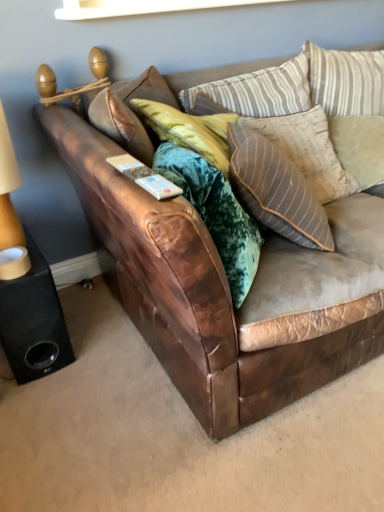
Where is `vacant point to the right of black matte speaker at lower left`? Image resolution: width=384 pixels, height=512 pixels. vacant point to the right of black matte speaker at lower left is located at coordinates (99, 347).